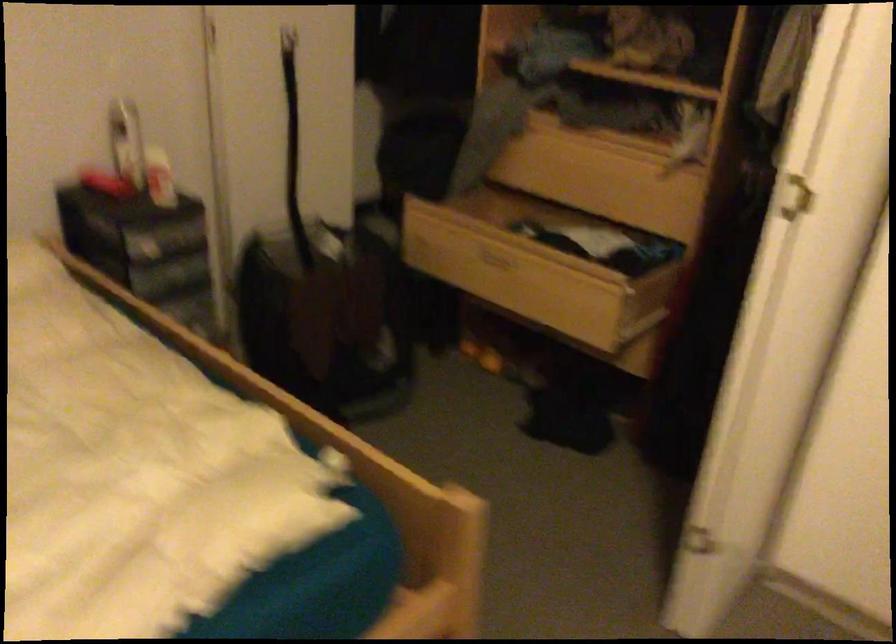
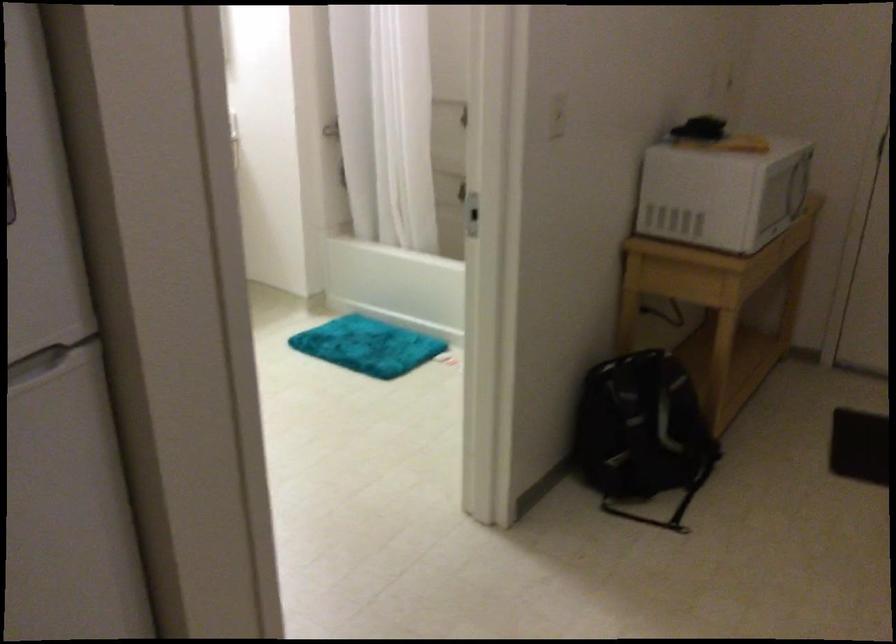
Question: In a continuous first-person perspective shot, in which direction is the camera moving?

Choices:
 (A) Left
 (B) Right
 (C) Forward
 (D) Backward

Answer: (B)